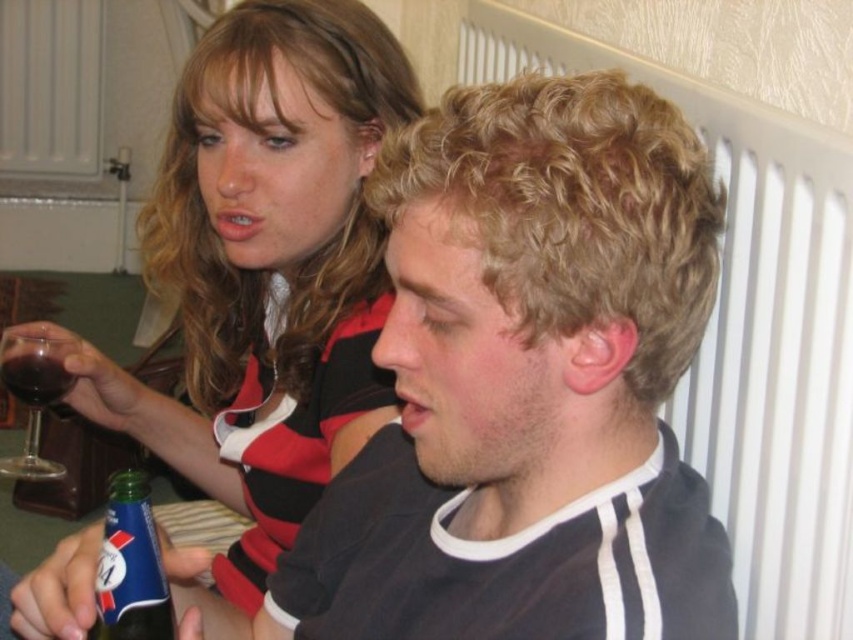
Question: Estimate the real-world distances between objects in this image. Which object is closer to the green glass bottle at lower left?

Choices:
 (A) transparent glass wine glass at left
 (B) dark red glass at upper left

Answer: (B)

Question: Can you confirm if matte black shirt at upper left is positioned to the right of green glass bottle at lower left?

Choices:
 (A) no
 (B) yes

Answer: (A)

Question: Which object is closer to the camera taking this photo?

Choices:
 (A) dark red glass at upper left
 (B) matte black shirt at upper left
 (C) transparent glass wine glass at left
 (D) white plastic radiator at upper right

Answer: (D)

Question: Does white plastic radiator at upper right appear under transparent glass wine glass at left?

Choices:
 (A) no
 (B) yes

Answer: (A)

Question: Can you confirm if white plastic radiator at upper right is positioned to the right of dark red glass at upper left?

Choices:
 (A) yes
 (B) no

Answer: (A)

Question: Which point is farther from the camera taking this photo?

Choices:
 (A) (26, 401)
 (B) (160, 579)

Answer: (A)